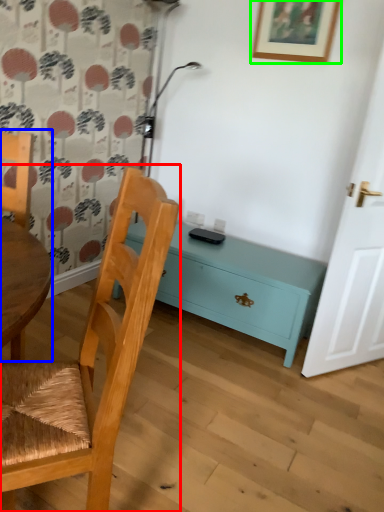
Question: Which object is positioned farthest from chair (highlighted by a red box)? Select from chair (highlighted by a blue box) and picture frame (highlighted by a green box).

Choices:
 (A) chair
 (B) picture frame

Answer: (B)